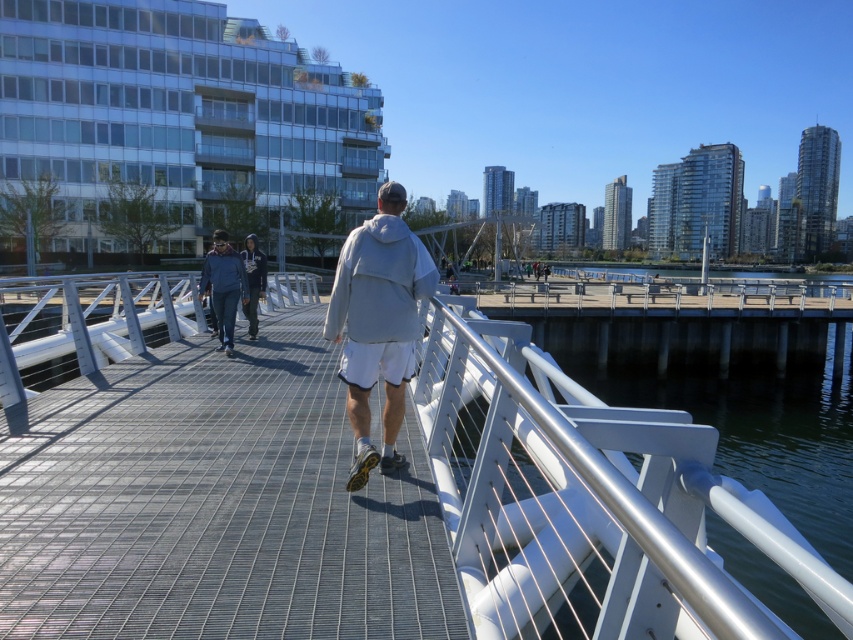
You are standing on the pedestrian bridge and want to cross to the other side. The metal grid walkway at center is represented by point (215, 502). Where should you step to stay on the metal grid walkway at center?

You should step on the point (215, 502) to stay on the metal grid walkway at center.

Consider the image. You are a photographer standing at the camera position in the scene. You want to capture a photo of the metal grid walkway at center without any people in the frame. Considering the distance between you and the walkway, can you zoom in enough to fill the frame with the walkway while avoiding the person walking towards the cityscape?

The metal grid walkway at center is 2.65 meters away from the camera. Since the photographer is close to the walkway, a standard zoom lens should allow filling the frame with the walkway while avoiding the person walking away, as they are further back towards the cityscape.

Based on the photo, you are a delivery drone operator. Your drone needs to fly from the metal grid walkway at center to the dark blue hoodie at center. Considering the height difference between them, will the drone have enough clearance to pass safely?

The metal grid walkway at center has a lesser height compared to dark blue hoodie at center. Since the drone is flying from the lower metal grid walkway at center to the higher dark blue hoodie at center, it will have sufficient clearance to pass safely.